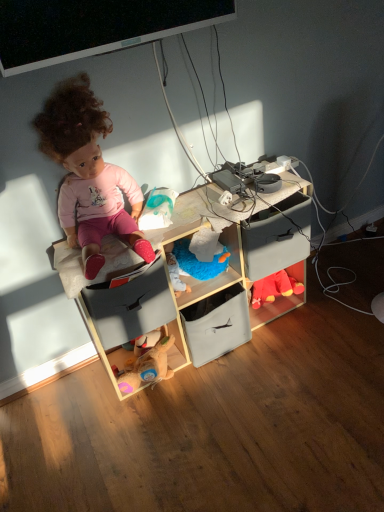
In order to click on vacant area on top of wooden cube at center, arranged as the 1th shelf when viewed from the left (from a real-world perspective) in this screenshot , I will do `click(179, 220)`.